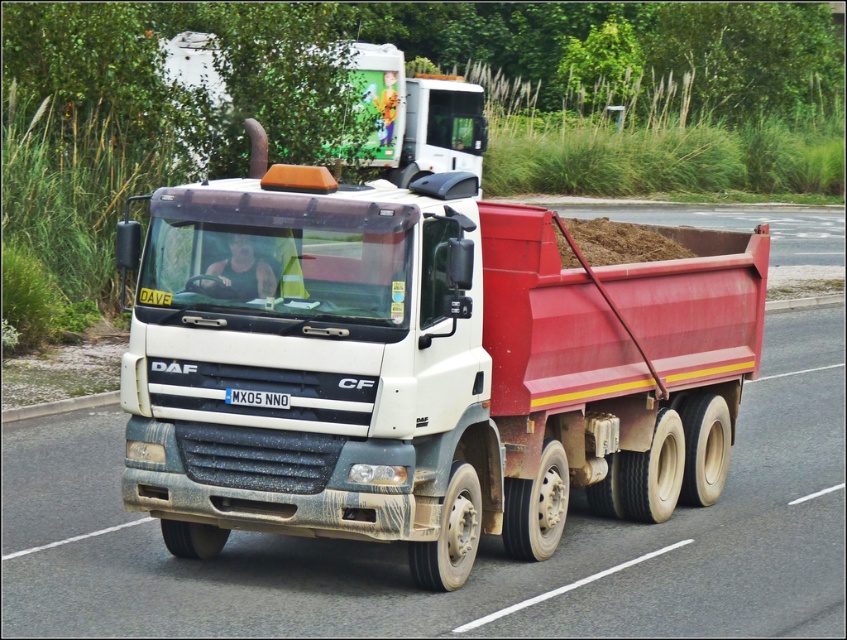
Question: Which object is farther from the camera taking this photo?

Choices:
 (A) dull white trailer truck at center
 (B) white matte truck at upper center
 (C) black plastic license plate at center

Answer: (B)

Question: Is dull white trailer truck at center further to camera compared to white matte truck at upper center?

Choices:
 (A) no
 (B) yes

Answer: (A)

Question: Among these objects, which one is nearest to the camera?

Choices:
 (A) dull white trailer truck at center
 (B) black plastic license plate at center

Answer: (A)

Question: Which point appears farthest from the camera in this image?

Choices:
 (A) (402, 157)
 (B) (477, 241)

Answer: (A)

Question: Is dull white trailer truck at center above white matte truck at upper center?

Choices:
 (A) yes
 (B) no

Answer: (B)

Question: Can you confirm if dull white trailer truck at center is positioned above black plastic license plate at center?

Choices:
 (A) yes
 (B) no

Answer: (B)